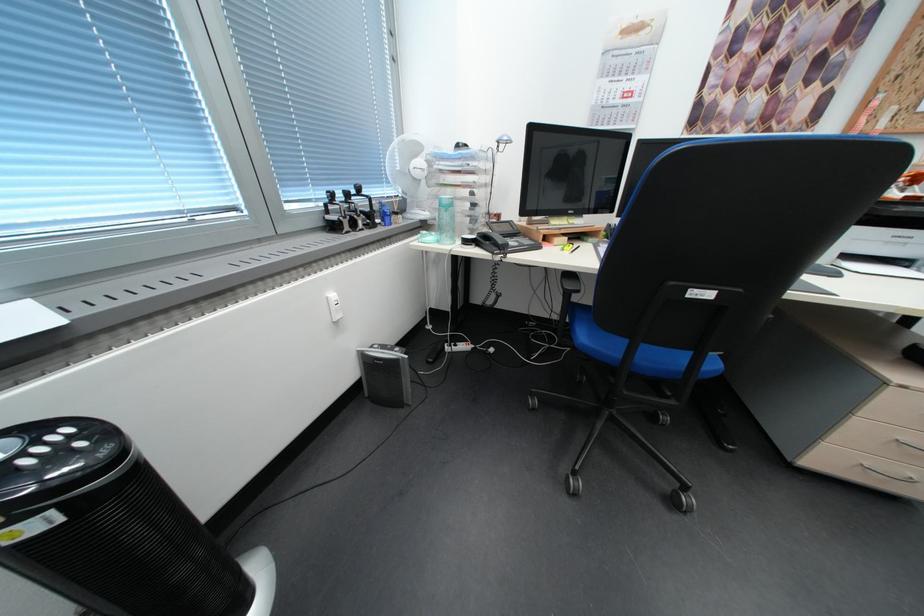
Locate an element on the screen. The image size is (924, 616). teal water bottle is located at coordinates (445, 220).